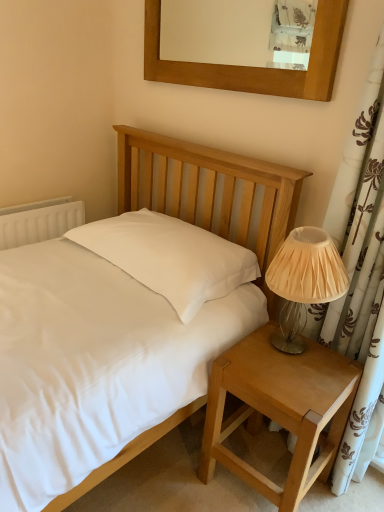
At what (x,y) coordinates should I click in order to perform the action: click on wooden picture frame at upper center. Please return your answer as a coordinate pair (x, y). Looking at the image, I should click on (254, 68).

This screenshot has height=512, width=384. I want to click on light brown wood nightstand at lower right, so [279, 409].

You are a GUI agent. You are given a task and a screenshot of the screen. Output one action in this format:
    pyautogui.click(x=<x>, y=<y>)
    Task: Click on the matte white bed at center
    This screenshot has height=512, width=384.
    Given the screenshot: What is the action you would take?
    pyautogui.click(x=211, y=191)

Between point (30, 214) and point (192, 194), which one is positioned in front?

Point (192, 194)

Is white plastic radiator at left wider or thinner than matte white bed at center?

In the image, white plastic radiator at left appears to be more narrow than matte white bed at center.

Based on their sizes in the image, would you say white plastic radiator at left is bigger or smaller than matte white bed at center?

Considering their sizes, white plastic radiator at left takes up less space than matte white bed at center.

From the image's perspective, between white plastic radiator at left and matte white bed at center, which one is located above?

From the image's view, white plastic radiator at left is above.

From a real-world perspective, between wooden picture frame at upper center and white plastic radiator at left, who is vertically lower?

white plastic radiator at left is physically lower.

How many degrees apart are the facing directions of wooden picture frame at upper center and white plastic radiator at left?

92.4 degrees.

In terms of height, does wooden picture frame at upper center look taller or shorter compared to white plastic radiator at left?

In the image, wooden picture frame at upper center appears to be taller than white plastic radiator at left.

Is wooden picture frame at upper center positioned with its back to white plastic radiator at left?

No, wooden picture frame at upper center is not facing the opposite direction of white plastic radiator at left.

Is matte white bed at center at the back of ivory pleated fabric lampshade at right?

No, ivory pleated fabric lampshade at right is not facing away from matte white bed at center.

Considering the positions of points (296, 336) and (192, 181), is point (296, 336) closer to camera compared to point (192, 181)?

Yes, point (296, 336) is closer to viewer.

Can you tell me how much ivory pleated fabric lampshade at right and matte white bed at center differ in facing direction?

They differ by 91.8 degrees in their facing directions.

Considering the positions of objects ivory pleated fabric lampshade at right and matte white bed at center in the image provided, who is behind, ivory pleated fabric lampshade at right or matte white bed at center?

ivory pleated fabric lampshade at right is more distant.

Which object is positioned more to the left, matte white bed at center or white plastic radiator at left?

white plastic radiator at left.

Is matte white bed at center positioned far away from white plastic radiator at left?

That's not correct — matte white bed at center is a little close to white plastic radiator at left.

Which is less distant, (128,152) or (17,240)?

Point (128,152).

Identify the location of table lamp on the right of wooden picture frame at upper center. The image size is (384, 512). (304, 281).

Can you confirm if ivory pleated fabric lampshade at right is thinner than wooden picture frame at upper center?

Incorrect, the width of ivory pleated fabric lampshade at right is not less than that of wooden picture frame at upper center.

How many degrees apart are the facing directions of ivory pleated fabric lampshade at right and wooden picture frame at upper center?

They differ by 0.811 degrees in their facing directions.

Which of these two, ivory pleated fabric lampshade at right or wooden picture frame at upper center, is smaller?

With smaller size is ivory pleated fabric lampshade at right.

Are matte white bed at center and ivory pleated fabric lampshade at right far apart?

They are positioned close to each other.

Who is shorter, matte white bed at center or ivory pleated fabric lampshade at right?

With less height is ivory pleated fabric lampshade at right.

Considering the relative sizes of matte white bed at center and ivory pleated fabric lampshade at right in the image provided, is matte white bed at center thinner than ivory pleated fabric lampshade at right?

No.

This screenshot has width=384, height=512. Identify the location of radiator that appears on the left of light brown wood nightstand at lower right. (39, 221).

Considering the positions of point (201, 468) and point (47, 228), is point (201, 468) closer or farther from the camera than point (47, 228)?

Point (201, 468) appears to be closer to the viewer than point (47, 228).

Which is correct: light brown wood nightstand at lower right is inside white plastic radiator at left, or outside of it?

light brown wood nightstand at lower right is located beyond the bounds of white plastic radiator at left.

This screenshot has width=384, height=512. What are the coordinates of `radiator located above the matte white bed at center (from a real-world perspective)` in the screenshot? It's located at (39, 221).

At what (x,y) coordinates should I click in order to perform the action: click on picture frame to the right of white plastic radiator at left. Please return your answer as a coordinate pair (x, y). This screenshot has height=512, width=384. Looking at the image, I should click on (254, 68).

From the image, which object appears to be farther from wooden picture frame at upper center, white plastic radiator at left or ivory pleated fabric lampshade at right?

Among the two, white plastic radiator at left is located further to wooden picture frame at upper center.

When comparing their distances from ivory pleated fabric lampshade at right, does wooden picture frame at upper center or light brown wood nightstand at lower right seem closer?

Among the two, light brown wood nightstand at lower right is located nearer to ivory pleated fabric lampshade at right.

In the scene shown: From the image, which object appears to be nearer to wooden picture frame at upper center, light brown wood nightstand at lower right or ivory pleated fabric lampshade at right?

ivory pleated fabric lampshade at right is closer to wooden picture frame at upper center.

Consider the image. From the image, which object appears to be farther from matte white bed at center, white plastic radiator at left or light brown wood nightstand at lower right?

white plastic radiator at left.

Considering their positions, is wooden picture frame at upper center positioned closer to light brown wood nightstand at lower right than white plastic radiator at left?

Based on the image, wooden picture frame at upper center appears to be nearer to light brown wood nightstand at lower right.

Based on their spatial positions, is ivory pleated fabric lampshade at right or white plastic radiator at left further from wooden picture frame at upper center?

white plastic radiator at left is further to wooden picture frame at upper center.

Based on their spatial positions, is light brown wood nightstand at lower right or wooden picture frame at upper center further from matte white bed at center?

light brown wood nightstand at lower right is positioned further to the anchor matte white bed at center.

Estimate the real-world distances between objects in this image. Which object is closer to ivory pleated fabric lampshade at right, wooden picture frame at upper center or white plastic radiator at left?

wooden picture frame at upper center lies closer to ivory pleated fabric lampshade at right than the other object.

Where is `picture frame between white plastic radiator at left and ivory pleated fabric lampshade at right from left to right`? This screenshot has width=384, height=512. picture frame between white plastic radiator at left and ivory pleated fabric lampshade at right from left to right is located at coordinates (254, 68).

You are a GUI agent. You are given a task and a screenshot of the screen. Output one action in this format:
    pyautogui.click(x=<x>, y=<y>)
    Task: Click on the nightstand located between matte white bed at center and white plastic radiator at left in the depth direction
    The width and height of the screenshot is (384, 512).
    Given the screenshot: What is the action you would take?
    pyautogui.click(x=279, y=409)

Find the location of a particular element. The image size is (384, 512). table lamp between wooden picture frame at upper center and matte white bed at center in the vertical direction is located at coordinates (304, 281).

Locate an element on the screen. This screenshot has width=384, height=512. radiator between wooden picture frame at upper center and light brown wood nightstand at lower right from top to bottom is located at coordinates point(39,221).